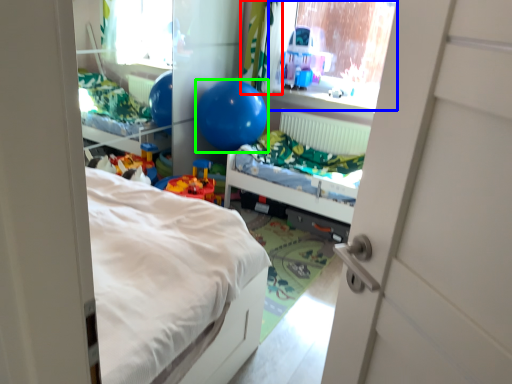
Question: Which object is the closest to the curtain (highlighted by a red box)? Choose among these: window screen (highlighted by a blue box) or balloon (highlighted by a green box).

Choices:
 (A) window screen
 (B) balloon

Answer: (B)